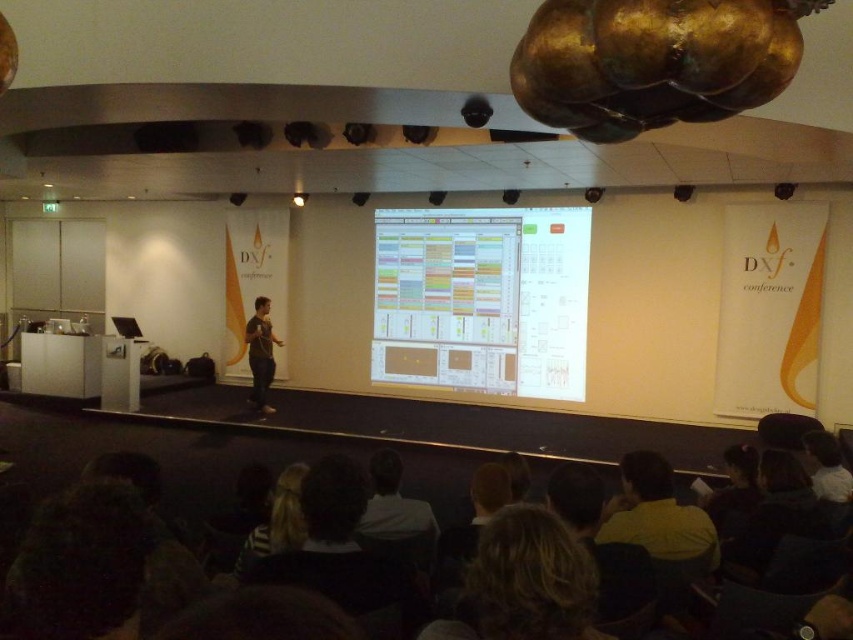
Is yellow matte shirt at lower center thinner than striped fabric hair at lower center?

Incorrect, yellow matte shirt at lower center's width is not less than striped fabric hair at lower center's.

Measure the distance between yellow matte shirt at lower center and camera.

A distance of 2.27 meters exists between yellow matte shirt at lower center and camera.

Identify the location of yellow matte shirt at lower center. (656, 513).

Which is more to the right, white glossy projection screen at center or striped fabric hair at lower center?

From the viewer's perspective, white glossy projection screen at center appears more on the right side.

How far apart are white glossy projection screen at center and striped fabric hair at lower center?

white glossy projection screen at center is 5.78 meters from striped fabric hair at lower center.

Between point (427, 371) and point (238, 572), which one is positioned behind?

The point (427, 371) is more distant.

The image size is (853, 640). Identify the location of white glossy projection screen at center. (482, 300).

The image size is (853, 640). Describe the element at coordinates (482, 300) in the screenshot. I see `white glossy projection screen at center` at that location.

Does point (540, 288) come farther from viewer compared to point (424, 515)?

Yes, it is behind point (424, 515).

The width and height of the screenshot is (853, 640). Identify the location of white glossy projection screen at center. (482, 300).

At what (x,y) coordinates should I click in order to perform the action: click on white glossy projection screen at center. Please return your answer as a coordinate pair (x, y). This screenshot has width=853, height=640. Looking at the image, I should click on (482, 300).